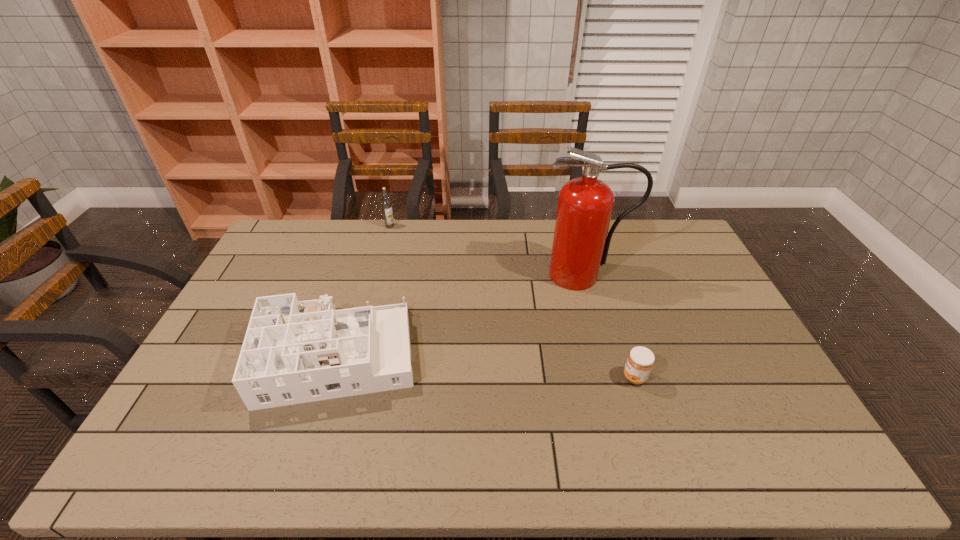
The image size is (960, 540). I want to click on vacant space in between the shortest object and the vodka, so click(513, 302).

Locate an element on the screen. Image resolution: width=960 pixels, height=540 pixels. free space between the second tallest object and the shortest object is located at coordinates (513, 302).

Where is `free space between the shortest object and the third shortest object`? free space between the shortest object and the third shortest object is located at coordinates (513, 302).

Locate an element on the screen. free spot between the tallest object and the shortest object is located at coordinates (610, 326).

At what (x,y) coordinates should I click in order to perform the action: click on free area in between the farthest object and the dollhouse. Please return your answer as a coordinate pair (x, y). This screenshot has width=960, height=540. Looking at the image, I should click on (364, 291).

Where is `vacant space in between the dollhouse and the farthest object`? This screenshot has height=540, width=960. vacant space in between the dollhouse and the farthest object is located at coordinates (364, 291).

I want to click on vacant area between the jam and the dollhouse, so click(x=486, y=366).

Identify the location of empty location between the second tallest object and the fire extinguisher. The height and width of the screenshot is (540, 960). point(487,251).

At what (x,y) coordinates should I click in order to perform the action: click on vacant region between the shortest object and the third tallest object. Please return your answer as a coordinate pair (x, y). The image size is (960, 540). Looking at the image, I should click on (486, 366).

Identify which object is located as the second nearest to the jam. Please provide its 2D coordinates. Your answer should be formatted as a tuple, i.e. [(x, y)], where the tuple contains the x and y coordinates of a point satisfying the conditions above.

[(294, 352)]